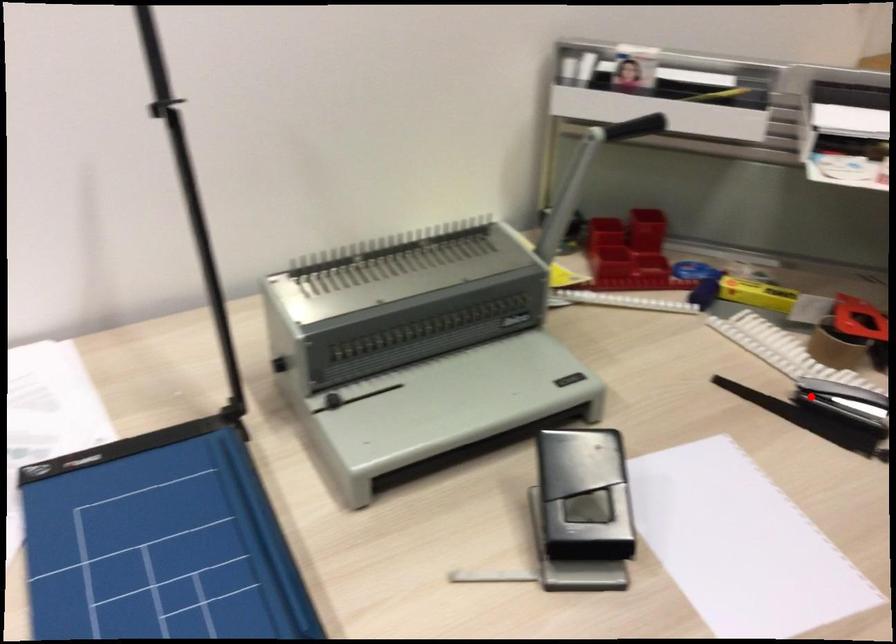
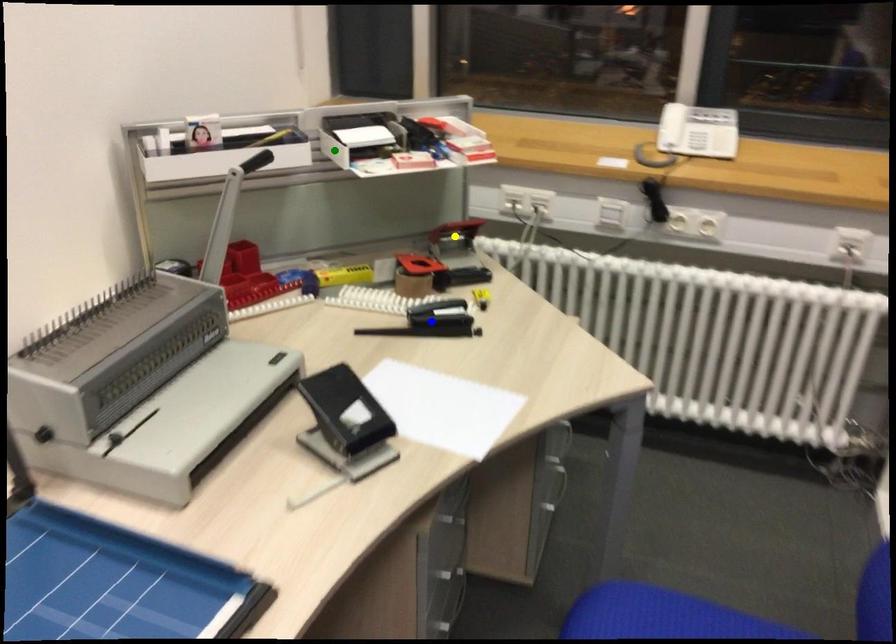
Question: I am providing you with two images of the same scene from different viewpoints. A red point is marked on the first image. You are given multiple points on the second image. Which mark in image 2 goes with the point in image 1?

Choices:
 (A) green point
 (B) yellow point
 (C) blue point

Answer: (C)